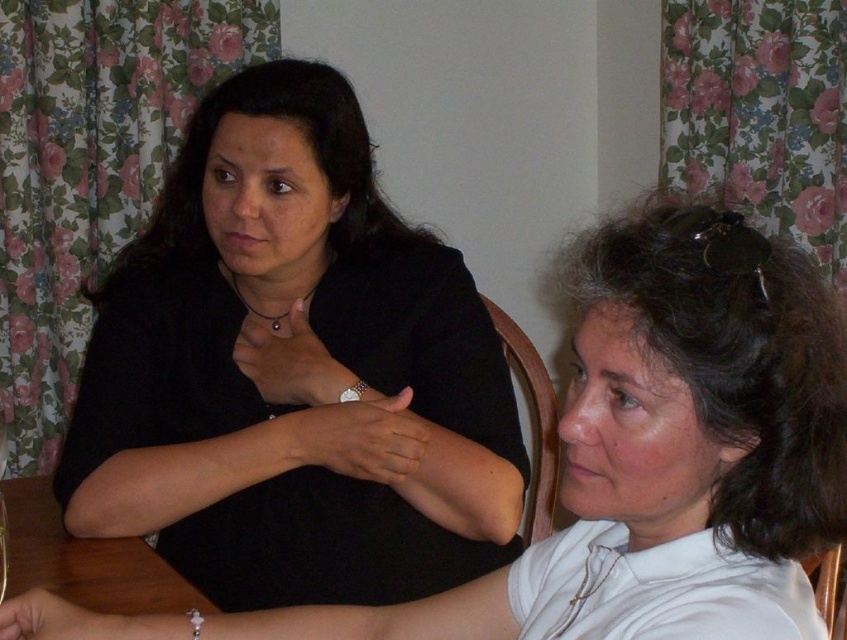
Question: Among these points, which one is nearest to the camera?

Choices:
 (A) (678, 360)
 (B) (163, 568)

Answer: (A)

Question: Which point is farther to the camera?

Choices:
 (A) pyautogui.click(x=137, y=486)
 (B) pyautogui.click(x=148, y=563)
 (C) pyautogui.click(x=746, y=291)

Answer: (B)

Question: Does matte black shirt at center come in front of brown wooden table at lower left?

Choices:
 (A) no
 (B) yes

Answer: (A)

Question: Which point is closer to the camera?

Choices:
 (A) brown wooden table at lower left
 (B) matte black shirt at upper left
 (C) matte black shirt at center

Answer: (B)

Question: Is matte black shirt at center below brown wooden table at lower left?

Choices:
 (A) yes
 (B) no

Answer: (B)

Question: Can you confirm if matte black shirt at center is positioned to the left of brown wooden table at lower left?

Choices:
 (A) no
 (B) yes

Answer: (A)